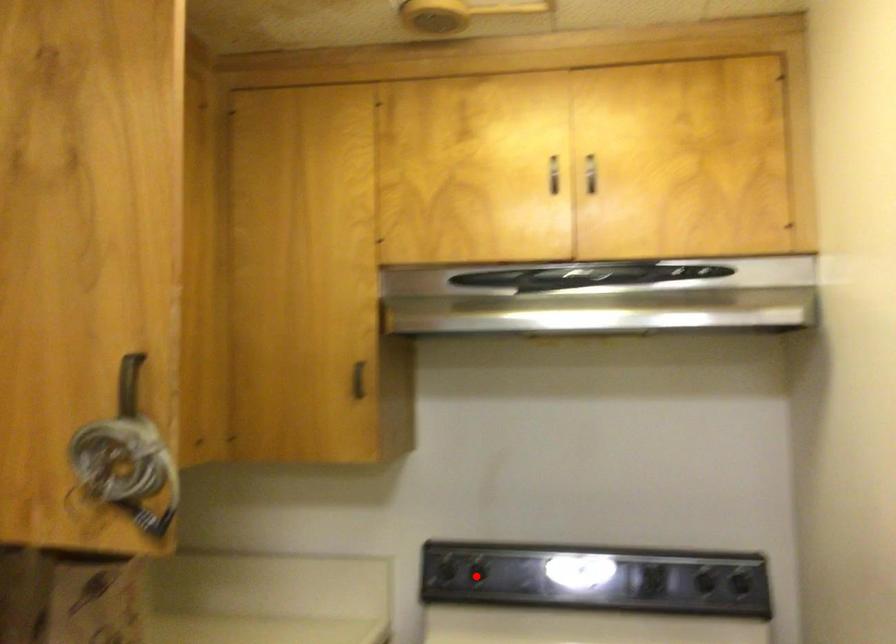
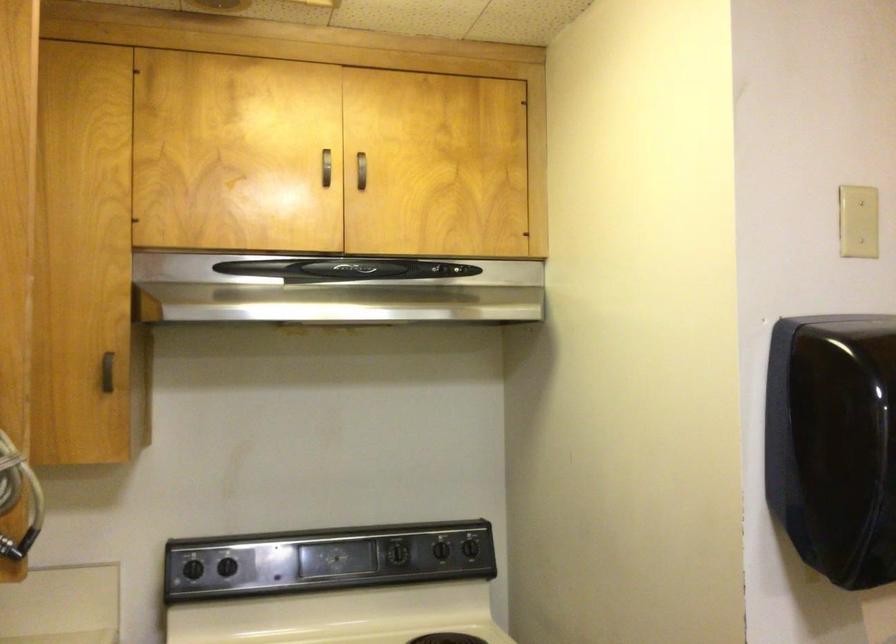
Question: I am providing you with two images of the same scene from different viewpoints. A red point is marked on the first image. Can you still see the location of the red point in image 2?

Choices:
 (A) Yes
 (B) No

Answer: (A)